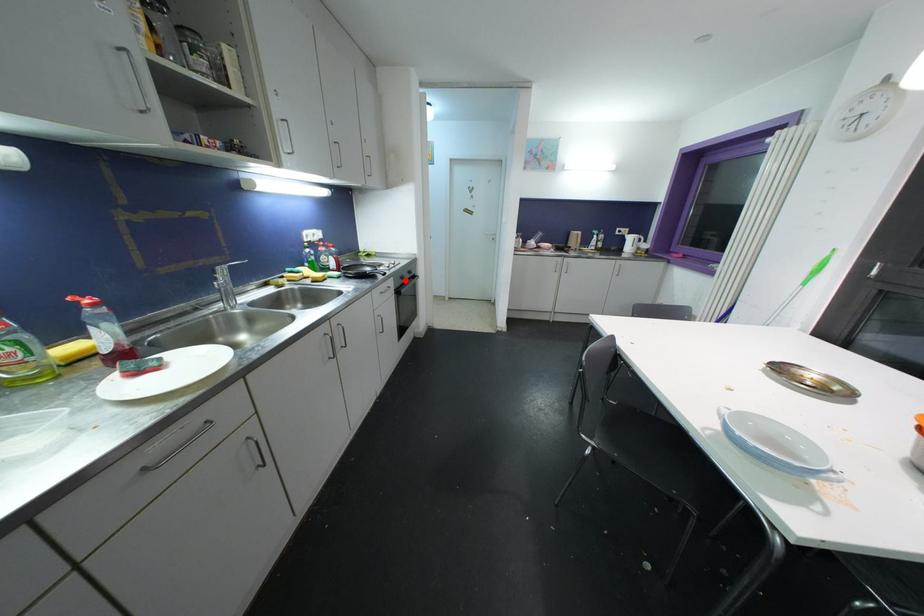
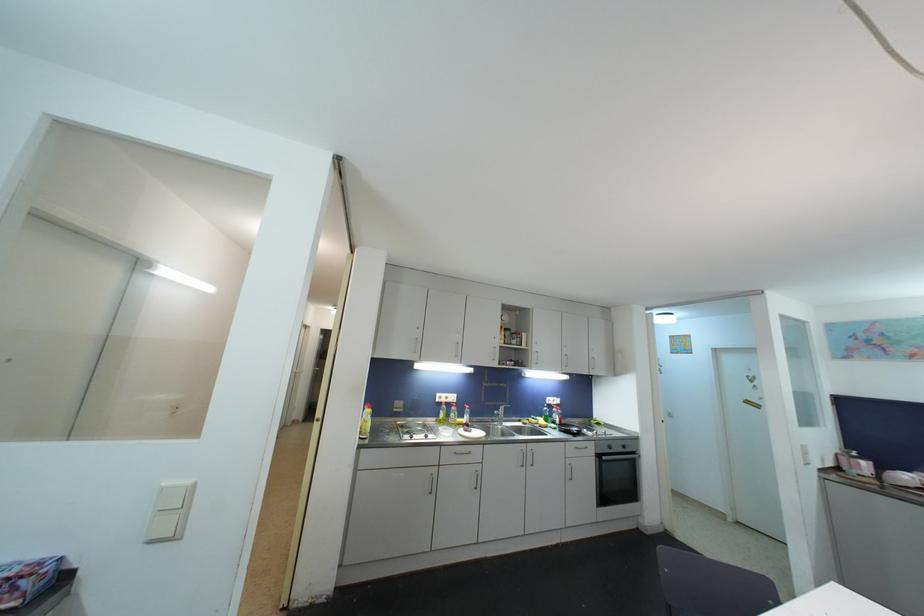
Question: I am providing you with two images of the same scene from different viewpoints. In image1, a red point is highlighted. Considering the same 3D point in image2, which of the following is correct?

Choices:
 (A) It is closer
 (B) It is farther

Answer: (B)